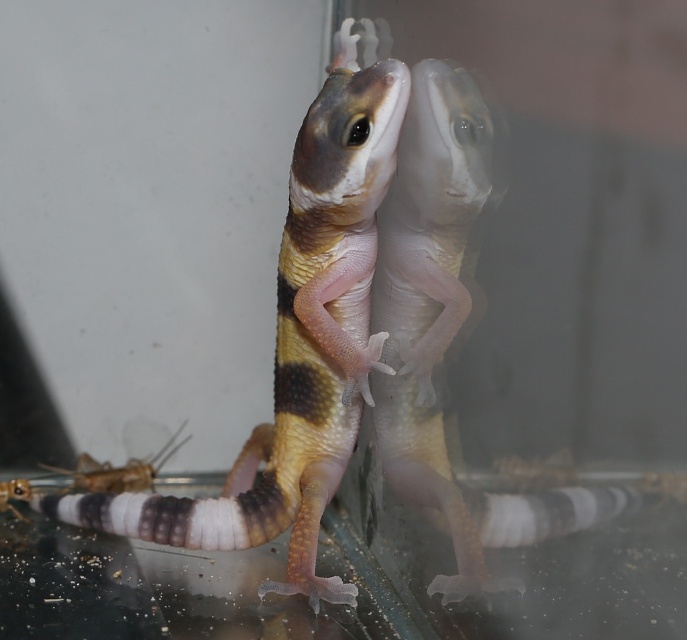
You are a researcher observing the gecko in its enclosure. You notice a point at coordinates [297,340]. What creature is located at that point?

The multicolored scaly lizard at center is located at point [297,340].

You are a pet owner who wants to ensure the safety of your multicolored scaly lizard at center and brown matte cricket at lower left in their shared enclosure. Considering their sizes, which one might have an easier time reaching the top of the enclosure?

The multicolored scaly lizard at center is bigger than the brown matte cricket at lower left, so it might have an easier time reaching the top of the enclosure due to its larger size and possibly better climbing abilities.